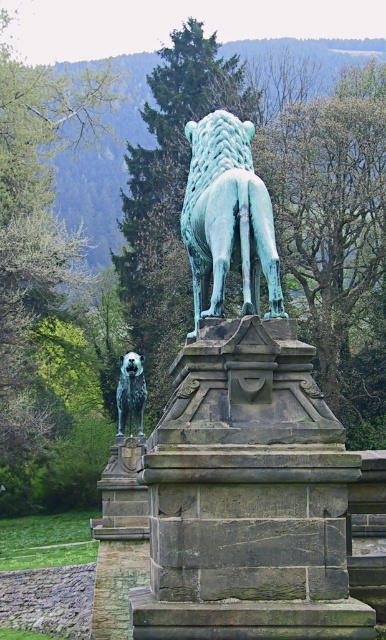
Question: Which is nearer to the shaggy fur dog at center?

Choices:
 (A) green patina lion at center
 (B) green patina stone lion at center

Answer: (B)

Question: Is green patina stone lion at center closer to the viewer compared to shaggy fur dog at center?

Choices:
 (A) no
 (B) yes

Answer: (B)

Question: Among these points, which one is nearest to the camera?

Choices:
 (A) (125, 412)
 (B) (260, 486)

Answer: (B)

Question: Which point is closer to the camera?

Choices:
 (A) green patina lion at center
 (B) green patina stone lion at center
 (C) shaggy fur dog at center

Answer: (B)

Question: Does green patina stone lion at center have a larger size compared to green patina lion at center?

Choices:
 (A) yes
 (B) no

Answer: (A)

Question: Does green patina lion at center have a lesser width compared to shaggy fur dog at center?

Choices:
 (A) no
 (B) yes

Answer: (A)